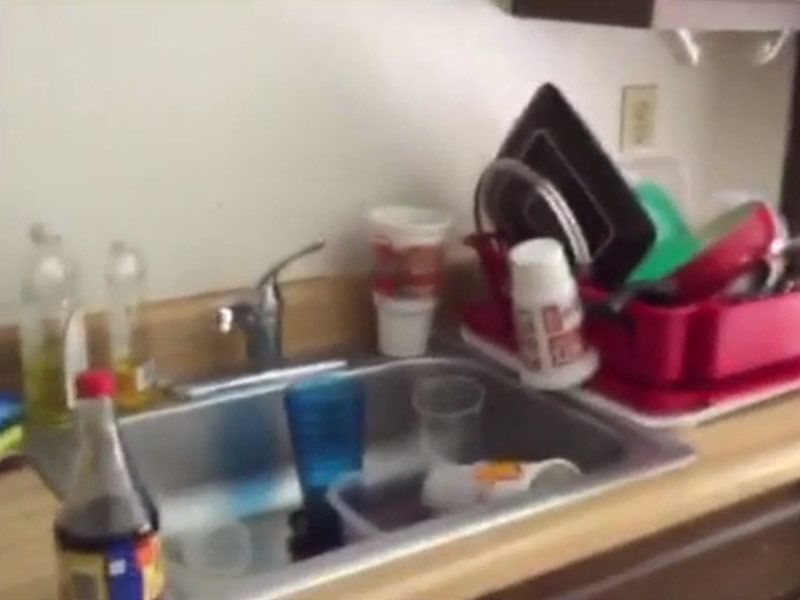
Where is `skillet`? This screenshot has width=800, height=600. skillet is located at coordinates (733, 252).